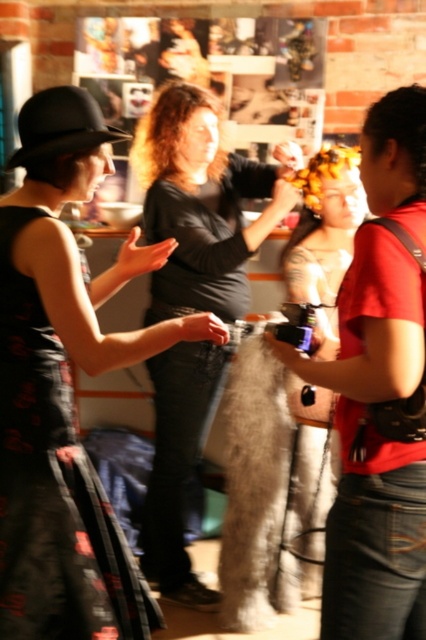
Which is in front, point (167, 372) or point (92, 528)?

Point (92, 528)

Does point (184, 304) lie in front of point (74, 522)?

No, (184, 304) is further to viewer.

Where is `black fuzzy coat at center`? The height and width of the screenshot is (640, 426). black fuzzy coat at center is located at coordinates (201, 204).

This screenshot has height=640, width=426. I want to click on black fuzzy coat at center, so click(201, 204).